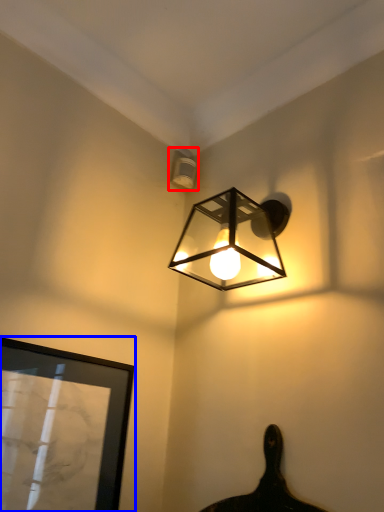
Question: Which object is further to the camera taking this photo, lamp (highlighted by a red box) or picture frame (highlighted by a blue box)?

Choices:
 (A) lamp
 (B) picture frame

Answer: (A)